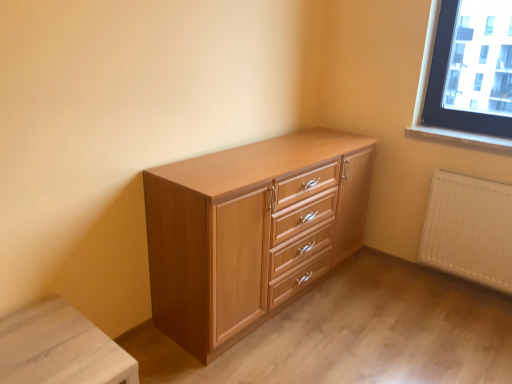
Locate an element on the screen. The width and height of the screenshot is (512, 384). vacant area that lies between light brown wood chest of drawers at center and white matte radiator at lower right is located at coordinates (377, 311).